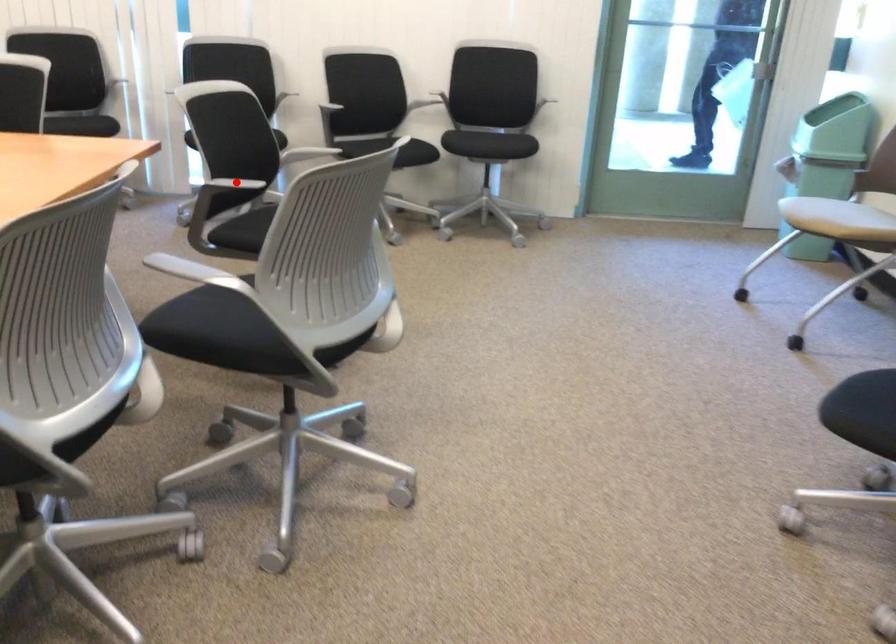
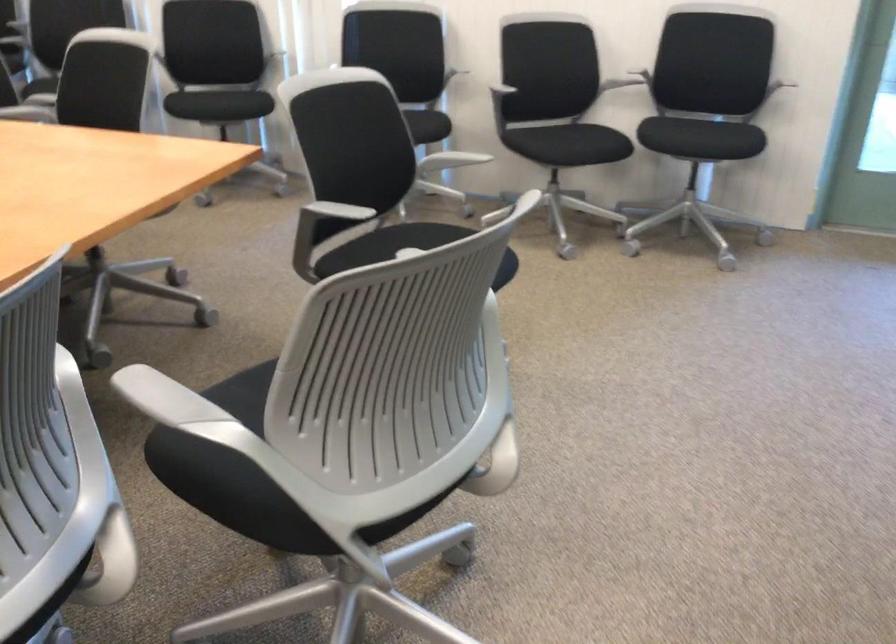
Where in the second image is the point corresponding to the highlighted location from the first image?

(332, 212)